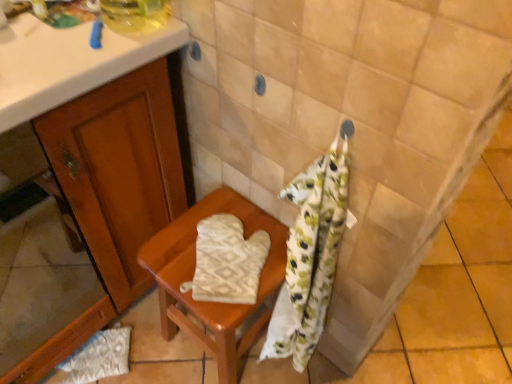
Question: Is the depth of white textured oven mitt at lower left greater than that of beige textured oven mitt at center?

Choices:
 (A) yes
 (B) no

Answer: (A)

Question: Does white textured oven mitt at lower left have a greater height compared to beige textured oven mitt at center?

Choices:
 (A) no
 (B) yes

Answer: (A)

Question: Is white textured oven mitt at lower left in front of beige textured oven mitt at center?

Choices:
 (A) no
 (B) yes

Answer: (A)

Question: Is white textured oven mitt at lower left surrounding beige textured oven mitt at center?

Choices:
 (A) no
 (B) yes

Answer: (A)

Question: Is white textured oven mitt at lower left to the left of beige textured oven mitt at center from the viewer's perspective?

Choices:
 (A) no
 (B) yes

Answer: (B)

Question: Can you confirm if white textured oven mitt at lower left is shorter than beige textured oven mitt at center?

Choices:
 (A) no
 (B) yes

Answer: (B)

Question: Could beige fabric oven mitt at center be considered to be inside white textured oven mitt at lower left?

Choices:
 (A) yes
 (B) no

Answer: (B)

Question: From a real-world perspective, is white textured oven mitt at lower left under beige fabric oven mitt at center?

Choices:
 (A) yes
 (B) no

Answer: (A)

Question: Does white textured oven mitt at lower left have a smaller size compared to beige fabric oven mitt at center?

Choices:
 (A) no
 (B) yes

Answer: (B)

Question: Is white textured oven mitt at lower left aimed at beige fabric oven mitt at center?

Choices:
 (A) yes
 (B) no

Answer: (B)

Question: Is white textured oven mitt at lower left oriented away from beige fabric oven mitt at center?

Choices:
 (A) yes
 (B) no

Answer: (B)

Question: Does white textured oven mitt at lower left have a lesser height compared to beige fabric oven mitt at center?

Choices:
 (A) yes
 (B) no

Answer: (A)

Question: Does beige textured oven mitt at center lie in front of beige fabric oven mitt at center?

Choices:
 (A) no
 (B) yes

Answer: (A)